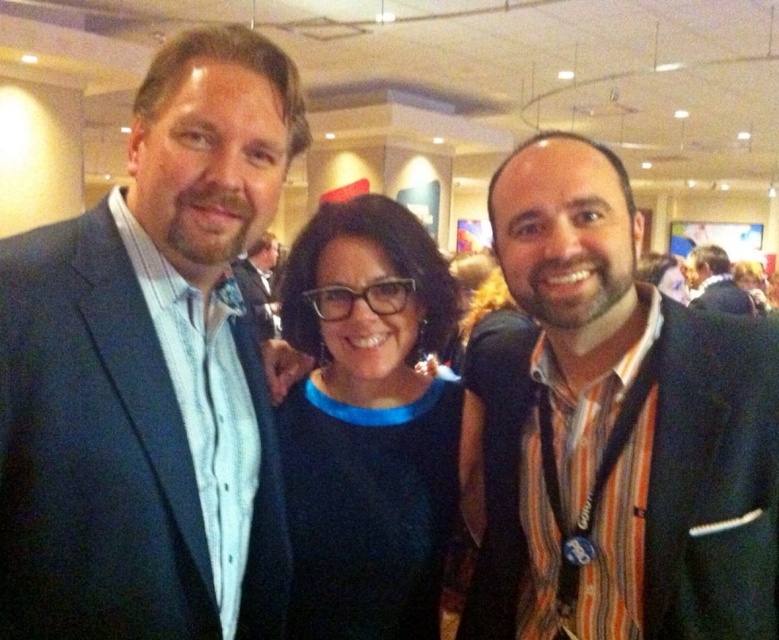
Can you confirm if matte blue suit at left is positioned below matte black suit at center?

Correct, matte blue suit at left is located below matte black suit at center.

Does matte blue suit at left have a lesser width compared to matte black suit at center?

Yes.

The image size is (779, 640). Find the location of `matte blue suit at left`. matte blue suit at left is located at coordinates (150, 371).

Find the location of a particular element. This screenshot has height=640, width=779. matte blue suit at left is located at coordinates (150, 371).

Is matte blue suit at left bigger than dark blue suit at right?

Incorrect, matte blue suit at left is not larger than dark blue suit at right.

Is matte blue suit at left positioned in front of dark blue suit at right?

Yes, it is in front of dark blue suit at right.

Is point (145, 136) behind point (689, 305)?

That is False.

Locate an element on the screen. The height and width of the screenshot is (640, 779). matte blue suit at left is located at coordinates (150, 371).

Does black matte dress at center have a lesser height compared to matte black suit at center?

Yes, black matte dress at center is shorter than matte black suit at center.

Can you confirm if black matte dress at center is positioned above matte black suit at center?

Actually, black matte dress at center is below matte black suit at center.

Does point (425, 500) lie in front of point (252, 300)?

Yes, it is in front of point (252, 300).

Locate an element on the screen. black matte dress at center is located at coordinates (367, 422).